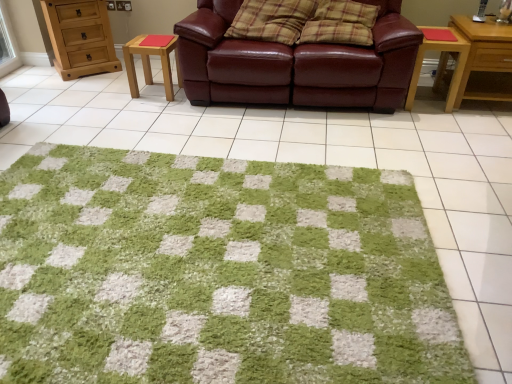
Question: From their relative heights in the image, would you say light brown wooden chest of drawers at upper left is taller or shorter than green shaggy rug at center?

Choices:
 (A) tall
 (B) short

Answer: (A)

Question: In the image, is light brown wooden chest of drawers at upper left on the left side or the right side of green shaggy rug at center?

Choices:
 (A) right
 (B) left

Answer: (B)

Question: Which object is positioned farthest from the wooden stool at center-left, the 2th table from the right?

Choices:
 (A) green shaggy rug at center
 (B) wooden side table at right, which is the first table in right-to-left order
 (C) light brown wooden chest of drawers at upper left
 (D) plaid fabric pillow at center, positioned as the 2th pillow in left-to-right order
 (E) leather couch at center

Answer: (B)

Question: Which is farther from the plaid fabric pillow at center, the first pillow when ordered from right to left?

Choices:
 (A) light brown wood nightstand at right
 (B) leather couch at center
 (C) plaid fabric pillow at center, placed as the second pillow when sorted from right to left
 (D) light brown wooden chest of drawers at upper left
 (E) wooden side table at right, which is the first table in right-to-left order

Answer: (D)